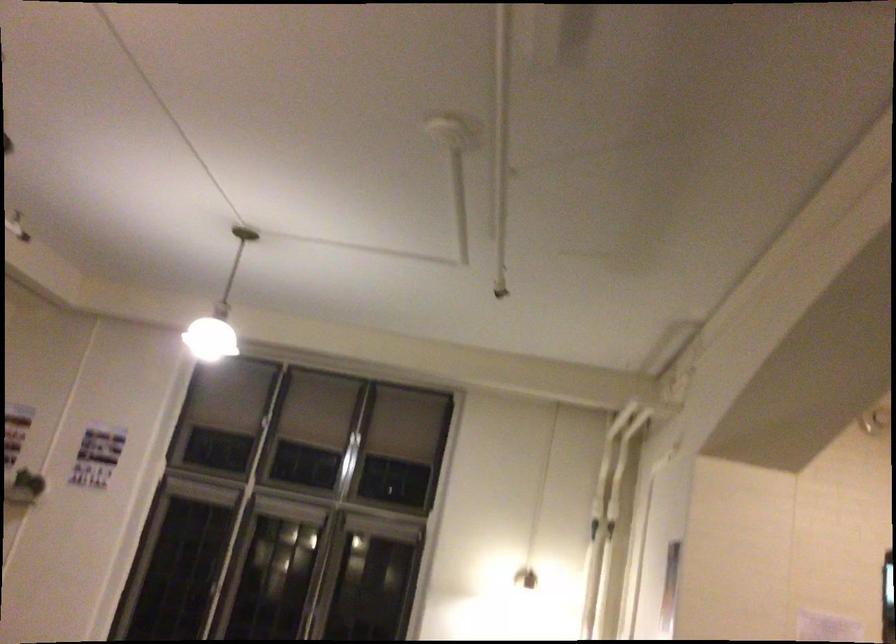
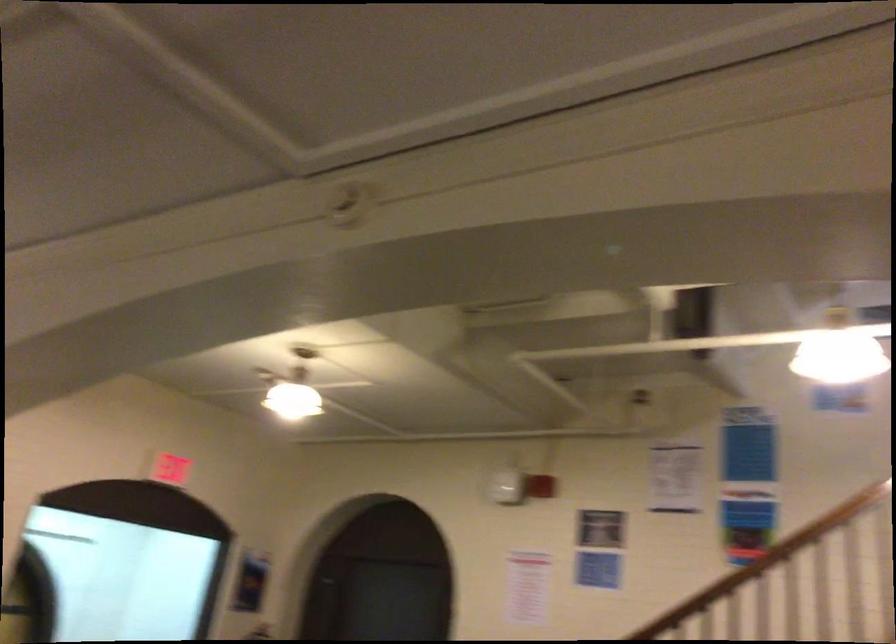
Question: The camera is either moving clockwise (left) or counter-clockwise (right) around the object. The first image is from the beginning of the video and the second image is from the end. Is the camera moving left or right when shooting the video?

Choices:
 (A) Left
 (B) Right

Answer: (A)